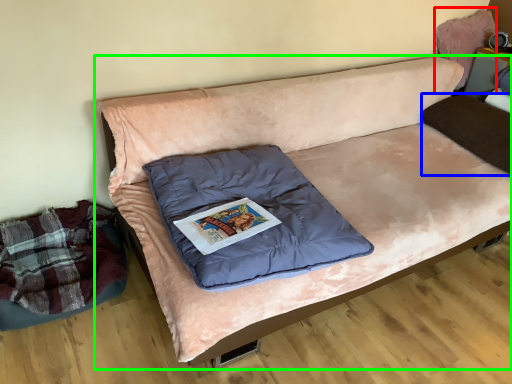
Question: Which object is the closest to the bean bag chair (highlighted by a red box)? Choose among these: pillow (highlighted by a blue box) or studio couch (highlighted by a green box).

Choices:
 (A) pillow
 (B) studio couch

Answer: (A)